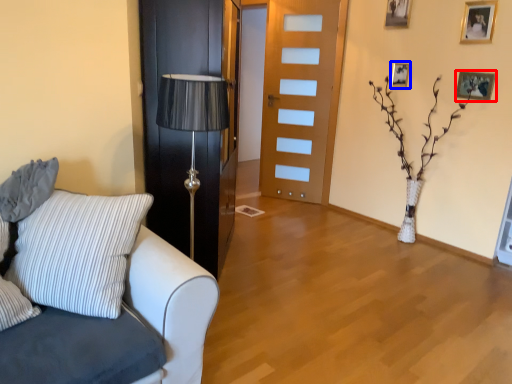
Question: Which of the following is the closest to the observer, picture frame (highlighted by a red box) or picture frame (highlighted by a blue box)?

Choices:
 (A) picture frame
 (B) picture frame

Answer: (A)